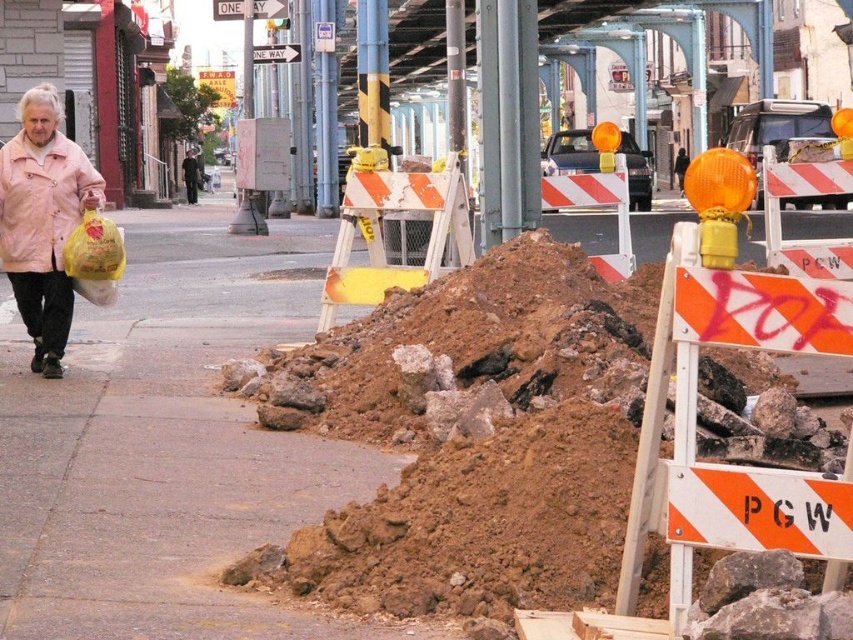
Question: Which is nearer to the white plastic one way sign at upper center?

Choices:
 (A) orange/white striped sign at lower right
 (B) brown dirt at center
 (C) matte pink jacket at left
 (D) pink matte jacket at left

Answer: (C)

Question: Which is nearer to the pink matte jacket at left?

Choices:
 (A) brown dirt at center
 (B) matte pink jacket at left
 (C) white plastic one way sign at upper center

Answer: (B)

Question: Estimate the real-world distances between objects in this image. Which object is closer to the pink matte jacket at left?

Choices:
 (A) orange/white striped sign at lower right
 (B) brown dirt at center
 (C) matte pink jacket at left
 (D) white plastic one way sign at upper center

Answer: (C)

Question: Does pink matte jacket at left have a larger size compared to white plastic sign at upper center?

Choices:
 (A) no
 (B) yes

Answer: (A)

Question: Does brown dirt at center appear on the left side of pink matte jacket at left?

Choices:
 (A) no
 (B) yes

Answer: (A)

Question: Is orange/white striped sign at lower right to the left of white plastic one way sign at upper center from the viewer's perspective?

Choices:
 (A) no
 (B) yes

Answer: (A)